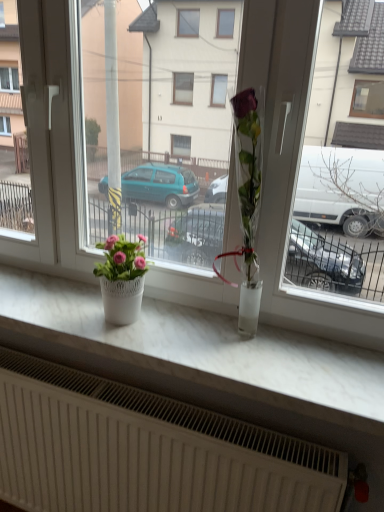
The width and height of the screenshot is (384, 512). What are the coordinates of `free point below pink matte flower pot at left (from a real-world perspective)` in the screenshot? It's located at (124, 320).